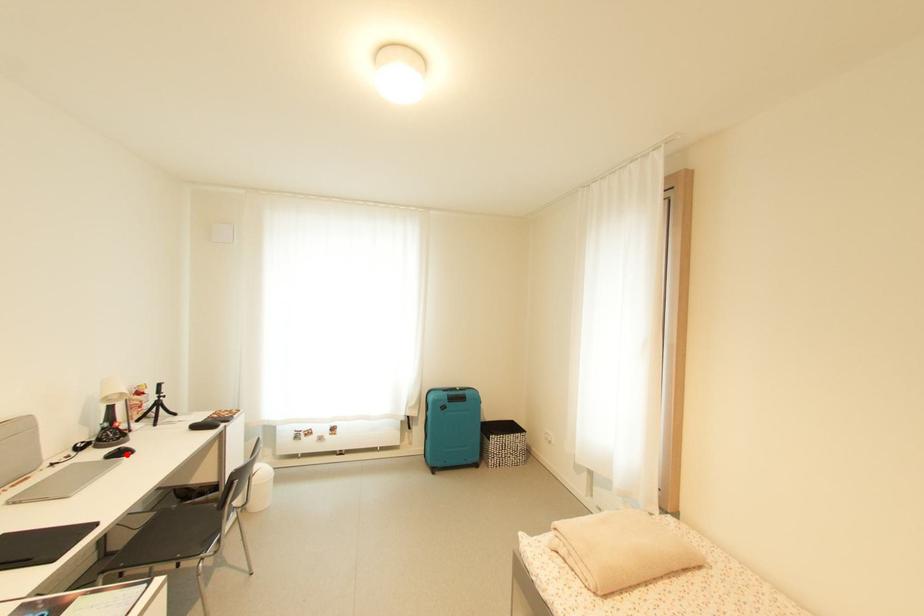
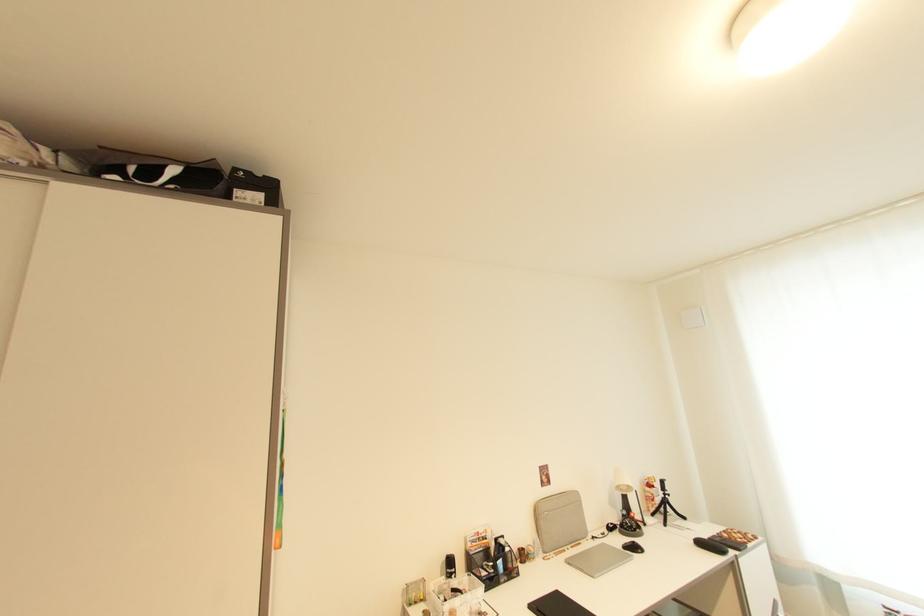
Question: I am providing you with two images of the same scene from different viewpoints. A red point is marked on the first image. Can you still see the location of the red point in image 2?

Choices:
 (A) Yes
 (B) No

Answer: (A)